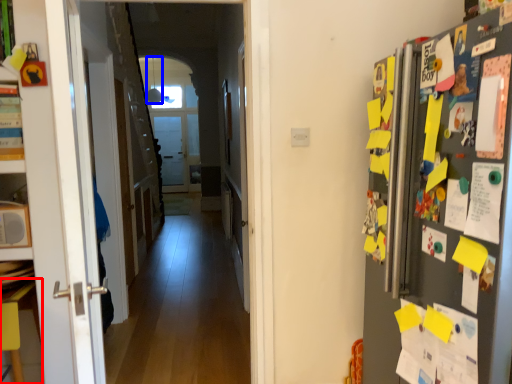
Question: Which point is further to the camera, table (highlighted by a red box) or lamp (highlighted by a blue box)?

Choices:
 (A) table
 (B) lamp

Answer: (B)